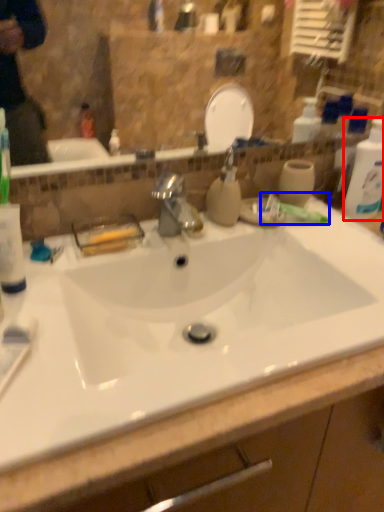
Question: Which object is further to the camera taking this photo, cleaning product (highlighted by a red box) or toothpaste (highlighted by a blue box)?

Choices:
 (A) cleaning product
 (B) toothpaste

Answer: (B)